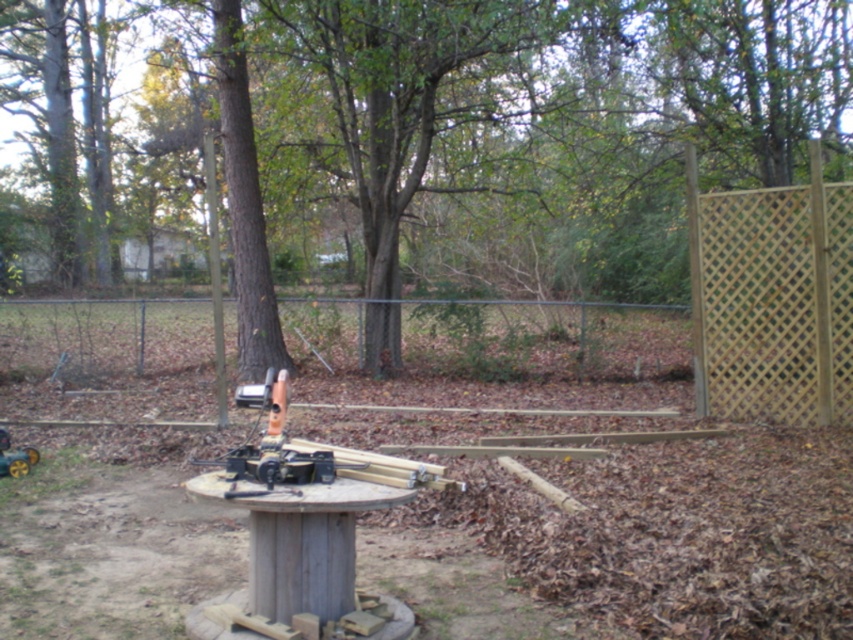
Does wooden lattice fence at center appear on the left side of light brown lattice fence at right?

Indeed, wooden lattice fence at center is positioned on the left side of light brown lattice fence at right.

In the scene shown: Measure the distance between wooden lattice fence at center and camera.

wooden lattice fence at center is 37.52 feet away from camera.

This screenshot has height=640, width=853. Identify the location of wooden lattice fence at center. (544, 339).

How much distance is there between brown wood tree at center and wooden lattice fence at center?

3.86 meters

Can you confirm if brown wood tree at center is smaller than wooden lattice fence at center?

Incorrect, brown wood tree at center is not smaller in size than wooden lattice fence at center.

Where is `brown wood tree at center`? This screenshot has height=640, width=853. brown wood tree at center is located at coordinates (511, 132).

Identify the location of brown wood tree at center. The width and height of the screenshot is (853, 640). (511, 132).

Does brown wood tree at center lie behind light brown lattice fence at right?

Yes, brown wood tree at center is behind light brown lattice fence at right.

Is brown wood tree at center to the left of light brown lattice fence at right from the viewer's perspective?

Yes, brown wood tree at center is to the left of light brown lattice fence at right.

Between point (253, 321) and point (843, 408), which one is positioned in front?

Point (843, 408) is in front.

Find the location of a particular element. brown wood tree at center is located at coordinates (511, 132).